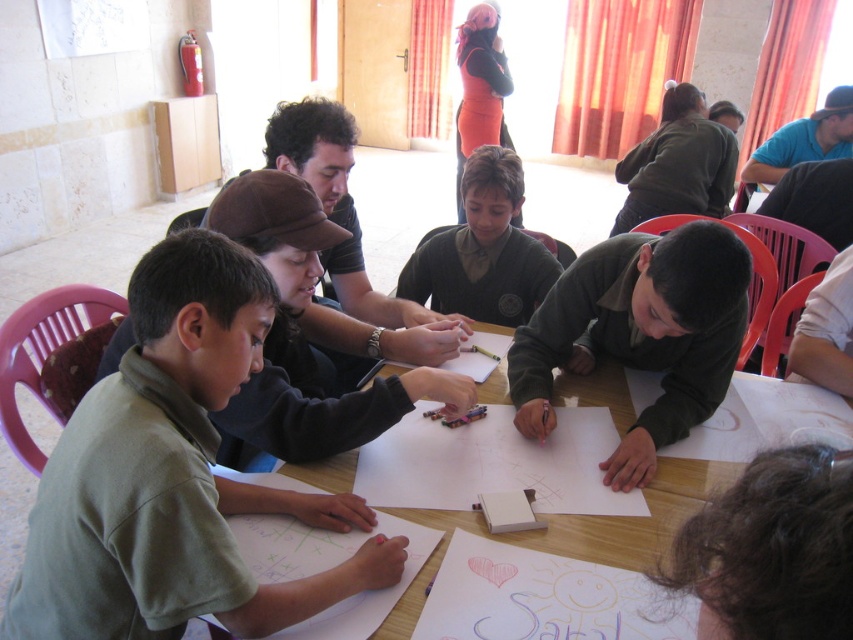
Can you confirm if green matte shirt at center is positioned to the left of dark green sweater at center?

Indeed, green matte shirt at center is positioned on the left side of dark green sweater at center.

Who is more distant from viewer, (102, 465) or (479, 278)?

The point (479, 278) is behind.

The image size is (853, 640). I want to click on green matte shirt at center, so click(x=173, y=476).

Which of these two, dark green sweater at center or blue shirt at upper right, stands shorter?

Standing shorter between the two is blue shirt at upper right.

Based on the photo, between dark green sweater at center and blue shirt at upper right, which one appears on the left side from the viewer's perspective?

From the viewer's perspective, dark green sweater at center appears more on the left side.

Which is behind, point (495, 264) or point (744, 168)?

Positioned behind is point (744, 168).

Where is `dark green sweater at center`? The width and height of the screenshot is (853, 640). dark green sweater at center is located at coordinates (483, 250).

Does matte black shirt at upper center have a greater width compared to blue shirt at upper right?

In fact, matte black shirt at upper center might be narrower than blue shirt at upper right.

Where is `matte black shirt at upper center`? matte black shirt at upper center is located at coordinates (349, 250).

Image resolution: width=853 pixels, height=640 pixels. I want to click on matte black shirt at upper center, so tap(349, 250).